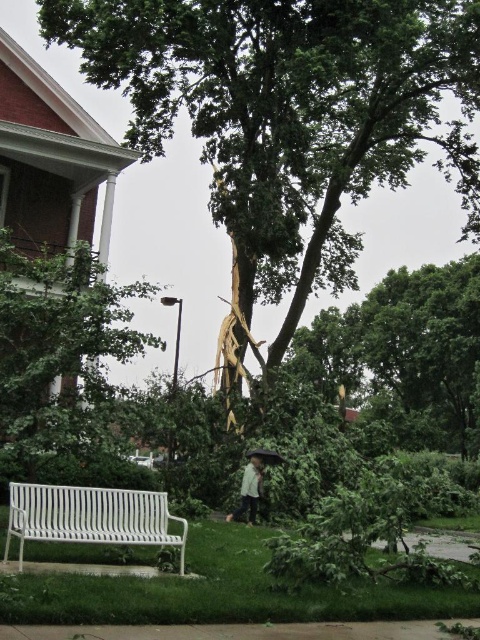
From the picture: Is green leafy tree at left positioned before white metal bench at lower left?

No, it is behind white metal bench at lower left.

From the picture: Does green leafy tree at left come behind white metal bench at lower left?

Yes, it is.

The width and height of the screenshot is (480, 640). I want to click on green leafy tree at left, so click(x=60, y=356).

Does white metal bench at lower left appear under black matte umbrella at center?

No.

Does white metal bench at lower left have a larger size compared to black matte umbrella at center?

Indeed, white metal bench at lower left has a larger size compared to black matte umbrella at center.

Describe the element at coordinates (91, 516) in the screenshot. I see `white metal bench at lower left` at that location.

Find the location of a particular element. The image size is (480, 640). white metal bench at lower left is located at coordinates (91, 516).

Is brown textured tree trunk at center to the left of green leafy tree at left from the viewer's perspective?

Incorrect, brown textured tree trunk at center is not on the left side of green leafy tree at left.

Is brown textured tree trunk at center wider than green leafy tree at left?

Indeed, brown textured tree trunk at center has a greater width compared to green leafy tree at left.

I want to click on brown textured tree trunk at center, so click(x=288, y=120).